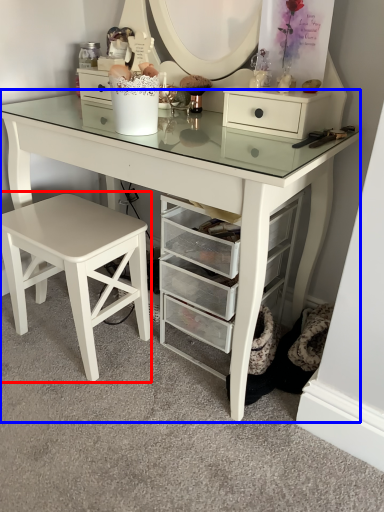
Question: Which object is further to the camera taking this photo, stool (highlighted by a red box) or table (highlighted by a blue box)?

Choices:
 (A) stool
 (B) table

Answer: (A)